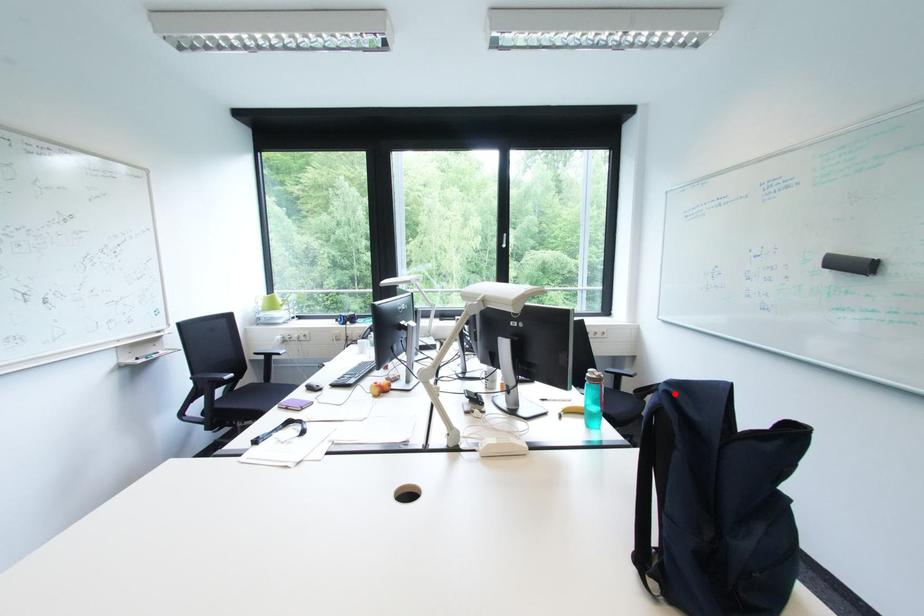
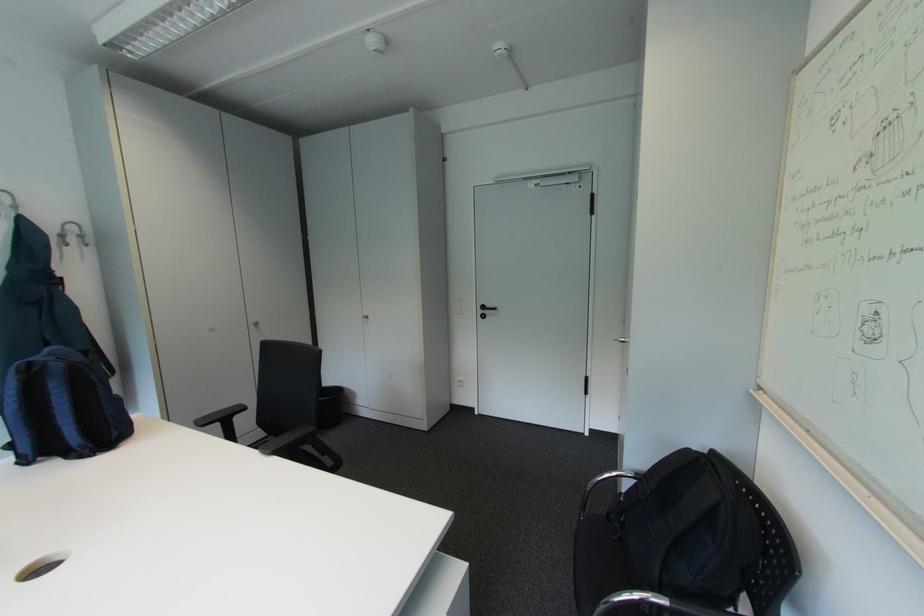
Question: I am providing you with two images of the same scene from different viewpoints. A red point is shown in image1. For the corresponding object point in image2, is it positioned nearer or farther from the camera?

Choices:
 (A) Nearer
 (B) Farther

Answer: (A)